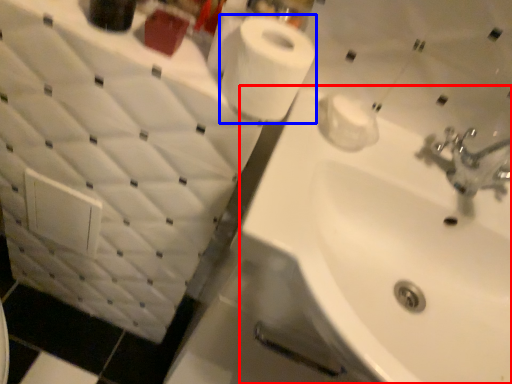
Question: Which object is further to the camera taking this photo, sink (highlighted by a red box) or toilet paper (highlighted by a blue box)?

Choices:
 (A) sink
 (B) toilet paper

Answer: (A)